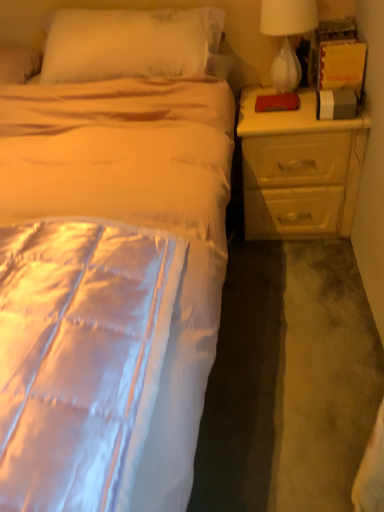
Identify the location of silky white bed at center. The width and height of the screenshot is (384, 512). (109, 289).

The image size is (384, 512). Find the location of `yellow matte nightstand at right`. yellow matte nightstand at right is located at coordinates (299, 169).

What are the coordinates of `silky white bed at center` in the screenshot? It's located at (x=109, y=289).

Measure the distance between silky white bed at center and yellow matte nightstand at right.

silky white bed at center and yellow matte nightstand at right are 21.23 inches apart.

Which object is wider, silky white bed at center or yellow matte nightstand at right?

Wider between the two is silky white bed at center.

Which of these two, silky white bed at center or yellow matte nightstand at right, stands taller?

With more height is silky white bed at center.

From a real-world perspective, is silky white bed at center positioned above or below yellow matte nightstand at right?

In terms of real-world spatial position, silky white bed at center is above yellow matte nightstand at right.

In the image, there is a white glass lamp at upper right. Find the location of `bed below it (from a real-world perspective)`. bed below it (from a real-world perspective) is located at coordinates (109, 289).

Does white glass lamp at upper right appear on the right side of silky white bed at center?

Indeed, white glass lamp at upper right is positioned on the right side of silky white bed at center.

Is point (286, 49) in front of point (181, 383)?

No.

How different are the orientations of yellow matte nightstand at right and silky white bed at center in degrees?

0.000178 degrees.

Is silky white bed at center a part of yellow matte nightstand at right?

No.

Between yellow matte nightstand at right and silky white bed at center, which one has smaller size?

Smaller between the two is yellow matte nightstand at right.

Is yellow matte nightstand at right aimed at silky white bed at center?

Yes, yellow matte nightstand at right is facing silky white bed at center.

Locate an element on the screen. The image size is (384, 512). lamp that is above the silky white bed at center (from the image's perspective) is located at coordinates (287, 37).

Who is shorter, silky white bed at center or white glass lamp at upper right?

Standing shorter between the two is white glass lamp at upper right.

From a real-world perspective, is silky white bed at center physically located above or below white glass lamp at upper right?

silky white bed at center is situated lower than white glass lamp at upper right in the real world.

Can you confirm if yellow matte nightstand at right is thinner than white glass lamp at upper right?

In fact, yellow matte nightstand at right might be wider than white glass lamp at upper right.

Considering the sizes of objects yellow matte nightstand at right and white glass lamp at upper right in the image provided, who is shorter, yellow matte nightstand at right or white glass lamp at upper right?

white glass lamp at upper right is shorter.

From the image's perspective, is yellow matte nightstand at right above or below white glass lamp at upper right?

Clearly, from the image's perspective, yellow matte nightstand at right is below white glass lamp at upper right.

Is yellow matte nightstand at right aimed at white glass lamp at upper right?

No, yellow matte nightstand at right is not turned towards white glass lamp at upper right.

Is white glass lamp at upper right not inside yellow matte nightstand at right?

Absolutely, white glass lamp at upper right is external to yellow matte nightstand at right.

Considering the positions of objects white glass lamp at upper right and yellow matte nightstand at right in the image provided, who is more to the left, white glass lamp at upper right or yellow matte nightstand at right?

Positioned to the left is white glass lamp at upper right.

Measure the distance from white glass lamp at upper right to yellow matte nightstand at right.

white glass lamp at upper right and yellow matte nightstand at right are 48.28 centimeters apart.

Is white glass lamp at upper right behind yellow matte nightstand at right?

Yes.

Locate an element on the screen. The image size is (384, 512). bed lying in front of the yellow matte nightstand at right is located at coordinates (109, 289).

The height and width of the screenshot is (512, 384). Find the location of `bed below the white glass lamp at upper right (from a real-world perspective)`. bed below the white glass lamp at upper right (from a real-world perspective) is located at coordinates point(109,289).

Based on their spatial positions, is white glass lamp at upper right or yellow matte nightstand at right closer to silky white bed at center?

yellow matte nightstand at right.

Looking at the image, which one is located further to yellow matte nightstand at right, silky white bed at center or white glass lamp at upper right?

silky white bed at center is positioned further to the anchor yellow matte nightstand at right.

From the image, which object appears to be nearer to silky white bed at center, yellow matte nightstand at right or white glass lamp at upper right?

yellow matte nightstand at right.

Which object lies nearer to the anchor point yellow matte nightstand at right, white glass lamp at upper right or silky white bed at center?

The object closer to yellow matte nightstand at right is white glass lamp at upper right.

When comparing their distances from white glass lamp at upper right, does yellow matte nightstand at right or silky white bed at center seem further?

silky white bed at center.

Estimate the real-world distances between objects in this image. Which object is further from white glass lamp at upper right, silky white bed at center or yellow matte nightstand at right?

silky white bed at center.

At what (x,y) coordinates should I click in order to perform the action: click on nightstand located between silky white bed at center and white glass lamp at upper right in the depth direction. Please return your answer as a coordinate pair (x, y). Looking at the image, I should click on (299, 169).